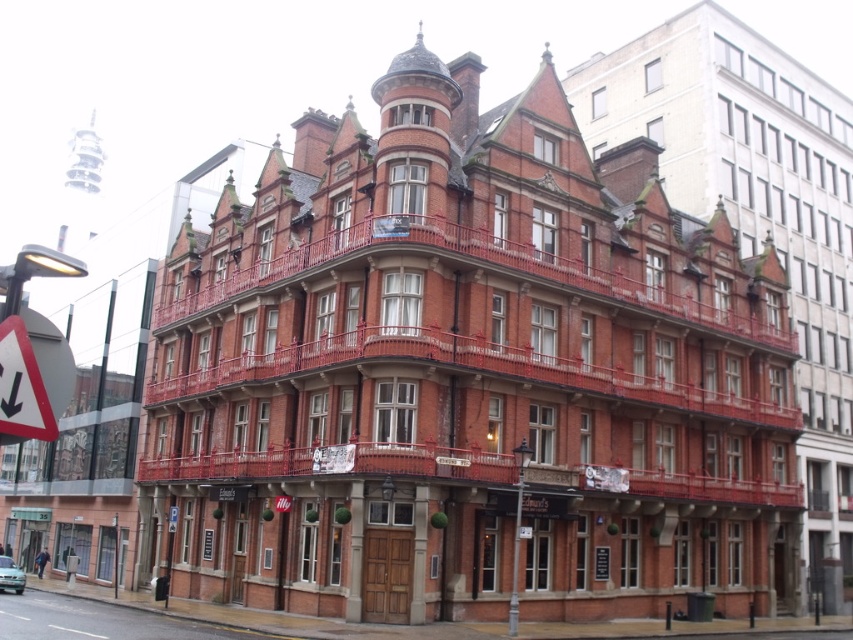
You are an architect evaluating the spatial compatibility of a new sculpture. The sculpture is a metallic reflective triangle at left. The existing brick building at center is a historic landmark. Considering their sizes, will the sculpture overwhelm the historic building?

The brick building at center is larger than the metallic reflective triangle at left, so the sculpture will not overwhelm the historic building.

You are standing in front of a building and see a point at coordinates (x=753, y=205). Based on the scene description, what does this point most likely represent?

The point at (x=753, y=205) most likely represents the brick building at center, as the coordinates are provided to indicate its location.